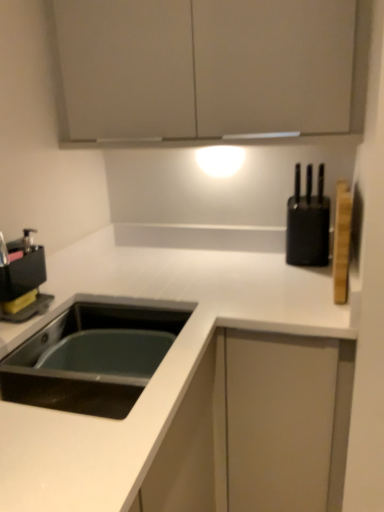
Question: Does black plastic coffee machine at left have a greater width compared to black matte sink at lower left?

Choices:
 (A) no
 (B) yes

Answer: (A)

Question: Does black plastic coffee machine at left have a smaller size compared to black matte sink at lower left?

Choices:
 (A) yes
 (B) no

Answer: (A)

Question: Does black plastic coffee machine at left have a lesser width compared to black matte sink at lower left?

Choices:
 (A) yes
 (B) no

Answer: (A)

Question: Is black matte sink at lower left inside black plastic coffee machine at left?

Choices:
 (A) no
 (B) yes

Answer: (A)

Question: From a real-world perspective, does black plastic coffee machine at left stand above black matte sink at lower left?

Choices:
 (A) no
 (B) yes

Answer: (B)

Question: Is black plastic coffee machine at left in contact with black matte sink at lower left?

Choices:
 (A) yes
 (B) no

Answer: (B)

Question: Are black plastic coffee machine at left and matte white cabinet at upper center far apart?

Choices:
 (A) no
 (B) yes

Answer: (A)

Question: Is black plastic coffee machine at left positioned with its back to matte white cabinet at upper center?

Choices:
 (A) no
 (B) yes

Answer: (A)

Question: From the image's perspective, would you say black plastic coffee machine at left is shown under matte white cabinet at upper center?

Choices:
 (A) no
 (B) yes

Answer: (B)

Question: Would you say black plastic coffee machine at left is outside matte white cabinet at upper center?

Choices:
 (A) yes
 (B) no

Answer: (A)

Question: Is black plastic coffee machine at left aimed at matte white cabinet at upper center?

Choices:
 (A) no
 (B) yes

Answer: (A)

Question: Does black plastic coffee machine at left have a greater width compared to matte white cabinet at upper center?

Choices:
 (A) no
 (B) yes

Answer: (A)

Question: Is matte white cabinet at upper center turned away from black plastic coffee machine at left?

Choices:
 (A) yes
 (B) no

Answer: (B)